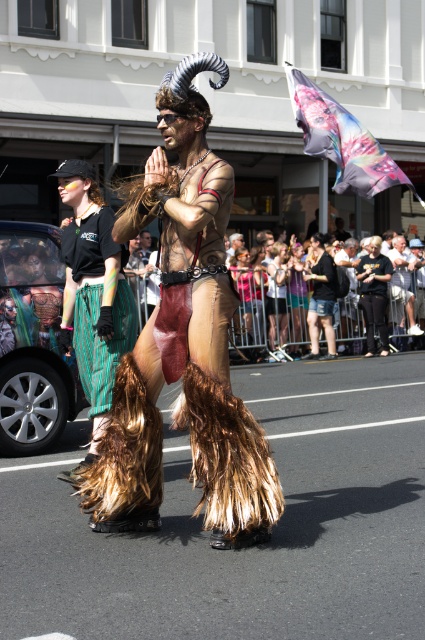
Is green striped pants at left further to camera compared to brown furry boots at lower center?

No.

Between green striped pants at left and brown furry boots at lower center, which one is positioned higher?

brown furry boots at lower center is above.

Measure the distance between green striped pants at left and camera.

They are 20.71 feet apart.

You are a GUI agent. You are given a task and a screenshot of the screen. Output one action in this format:
    pyautogui.click(x=<x>, y=<y>)
    Task: Click on the green striped pants at left
    This screenshot has width=425, height=640.
    Given the screenshot: What is the action you would take?
    pyautogui.click(x=98, y=305)

Locate an element on the screen. brown fur skirt at center is located at coordinates (184, 344).

Can you confirm if brown fur skirt at center is positioned above brown furry boots at lower center?

Actually, brown fur skirt at center is below brown furry boots at lower center.

Describe the element at coordinates (184, 344) in the screenshot. The height and width of the screenshot is (640, 425). I see `brown fur skirt at center` at that location.

This screenshot has width=425, height=640. I want to click on brown fur skirt at center, so click(184, 344).

Who is more distant from viewer, (359, 262) or (405, 262)?

The point (405, 262) is more distant.

Measure the distance from light brown fabric crowd at center to brown furry boots at lower center.

The distance of light brown fabric crowd at center from brown furry boots at lower center is 6.04 feet.

Is point (399, 285) less distant than point (401, 257)?

Yes, it is.

This screenshot has height=640, width=425. I want to click on light brown fabric crowd at center, so click(x=306, y=298).